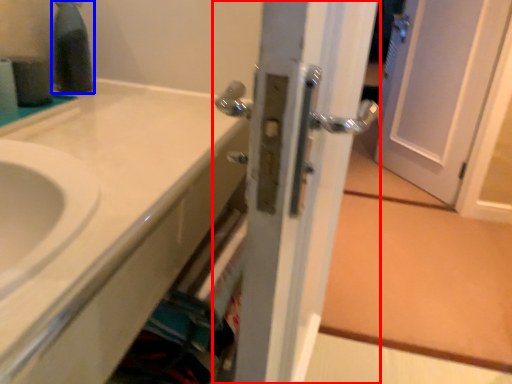
Question: Which of the following is the closest to the observer, door (highlighted by a red box) or bottle (highlighted by a blue box)?

Choices:
 (A) door
 (B) bottle

Answer: (A)